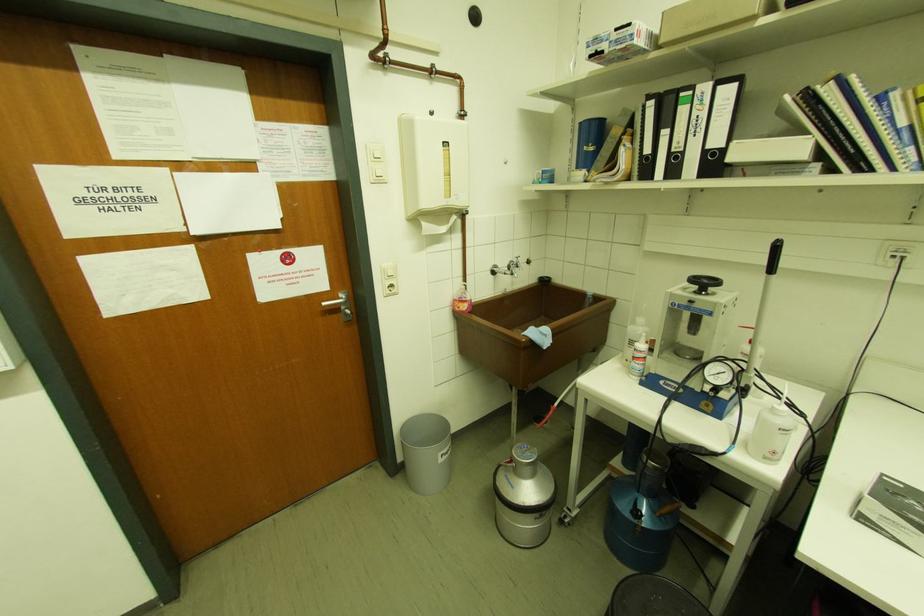
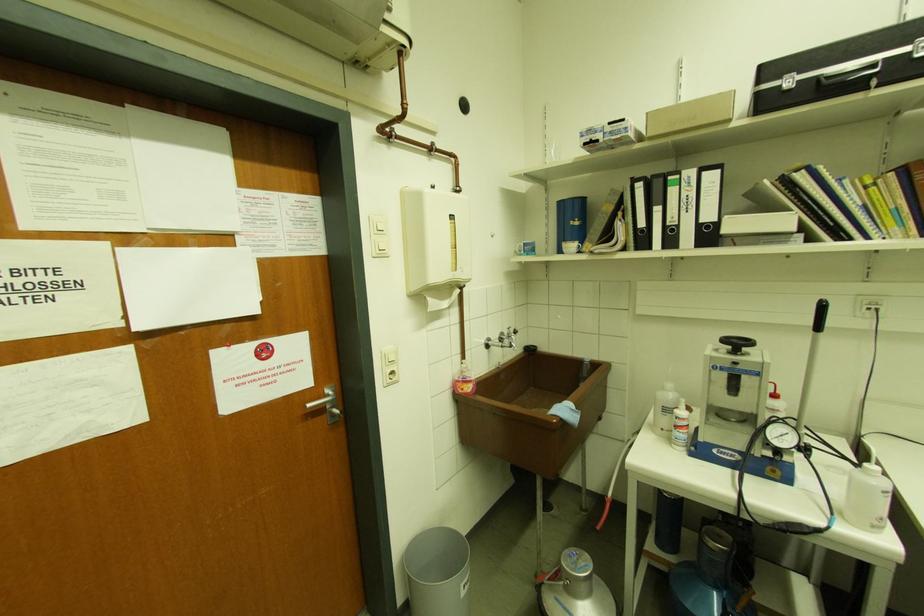
Locate, in the second image, the point that corresponds to (x=509, y=267) in the first image.

(501, 339)